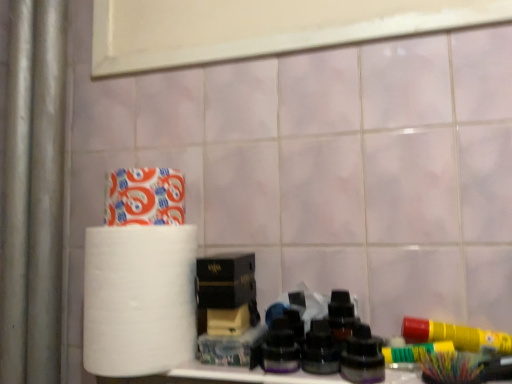
You are a GUI agent. You are given a task and a screenshot of the screen. Output one action in this format:
    pyautogui.click(x=<x>, y=<y>)
    Task: Click on the white matte paper towel at left
    The height and width of the screenshot is (384, 512).
    Given the screenshot: What is the action you would take?
    pyautogui.click(x=139, y=299)

Where is `white matte toilet paper at upper left`? The image size is (512, 384). white matte toilet paper at upper left is located at coordinates (144, 197).

From the picture: Considering the relative sizes of white matte paper towel at left and white matte toilet paper at upper left in the image provided, is white matte paper towel at left wider than white matte toilet paper at upper left?

Correct, the width of white matte paper towel at left exceeds that of white matte toilet paper at upper left.

From a real-world perspective, does white matte paper towel at left stand above white matte toilet paper at upper left?

No.

Based on the photo, in terms of size, does white matte paper towel at left appear bigger or smaller than white matte toilet paper at upper left?

In the image, white matte paper towel at left appears to be larger than white matte toilet paper at upper left.

Which is in front, white matte paper towel at left or white matte toilet paper at upper left?

Positioned in front is white matte paper towel at left.

Does point (143, 198) appear closer or farther from the camera than point (135, 350)?

Point (143, 198) is farther from the camera than point (135, 350).

Who is smaller, white matte toilet paper at upper left or white matte paper towel at left?

Smaller between the two is white matte toilet paper at upper left.

Is white matte toilet paper at upper left far away from white matte paper towel at left?

Actually, white matte toilet paper at upper left and white matte paper towel at left are a little close together.

Between white matte toilet paper at upper left and white matte paper towel at left, which one is positioned in front?

white matte paper towel at left is more forward.

From the picture: Is white matte paper towel at left taller or shorter than black matte box at center?

Clearly, white matte paper towel at left is taller compared to black matte box at center.

Is black matte box at center completely or partially inside white matte paper towel at left?

No.

From a real-world perspective, is white matte paper towel at left positioned above or below black matte box at center?

In terms of real-world spatial position, white matte paper towel at left is below black matte box at center.

From the image's perspective, relative to black matte box at center, is white matte paper towel at left above or below?

Based on their image positions, white matte paper towel at left is located beneath black matte box at center.

From the picture: Considering the relative sizes of black matte box at center and white matte toilet paper at upper left in the image provided, is black matte box at center thinner than white matte toilet paper at upper left?

Yes.

Does black matte box at center appear on the right side of white matte toilet paper at upper left?

Yes, black matte box at center is to the right of white matte toilet paper at upper left.

Is black matte box at center aimed at white matte toilet paper at upper left?

No.

How far apart are black matte box at center and white matte toilet paper at upper left?

black matte box at center and white matte toilet paper at upper left are 5.24 inches apart from each other.

Would you consider white matte toilet paper at upper left to be distant from black matte box at center?

Actually, white matte toilet paper at upper left and black matte box at center are a little close together.

From the image's perspective, which one is positioned lower, white matte toilet paper at upper left or black matte box at center?

black matte box at center appears lower in the image.

Is point (139, 223) closer to viewer compared to point (212, 300)?

Yes, it is.

Is black matte box at center facing away from white matte paper towel at left?

black matte box at center is not turned away from white matte paper towel at left.

From the image's perspective, relative to white matte paper towel at left, is black matte box at center above or below?

Based on their image positions, black matte box at center is located above white matte paper towel at left.

Would you say black matte box at center is to the left or to the right of white matte paper towel at left in the picture?

black matte box at center is to the right of white matte paper towel at left.

This screenshot has width=512, height=384. In order to click on toilet paper lying on the right of white matte paper towel at left in this screenshot , I will do `click(144, 197)`.

Identify the location of toilet paper positioned vertically above the white matte paper towel at left (from a real-world perspective). (144, 197).

Estimate the real-world distances between objects in this image. Which object is further from white matte toilet paper at upper left, white matte paper towel at left or black matte box at center?

black matte box at center is further to white matte toilet paper at upper left.

Looking at the image, which one is located further to white matte paper towel at left, white matte toilet paper at upper left or black matte box at center?

The object further to white matte paper towel at left is white matte toilet paper at upper left.

From the image, which object appears to be farther from black matte box at center, white matte toilet paper at upper left or white matte paper towel at left?

white matte toilet paper at upper left is further to black matte box at center.

Looking at the image, which one is located further to white matte paper towel at left, black matte box at center or white matte toilet paper at upper left?

white matte toilet paper at upper left is further to white matte paper towel at left.

Looking at the image, which one is located further to black matte box at center, white matte paper towel at left or white matte toilet paper at upper left?

The object further to black matte box at center is white matte toilet paper at upper left.

Estimate the real-world distances between objects in this image. Which object is further from white matte toilet paper at upper left, black matte box at center or white matte paper towel at left?

Among the two, black matte box at center is located further to white matte toilet paper at upper left.

The width and height of the screenshot is (512, 384). I want to click on toilet paper between white matte paper towel at left and black matte box at center, so pyautogui.click(x=144, y=197).